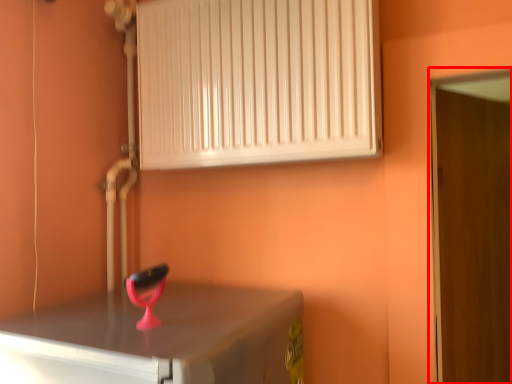
Question: Considering the relative positions of door (annotated by the red box) and radiator in the image provided, where is door (annotated by the red box) located with respect to the staircase?

Choices:
 (A) left
 (B) right

Answer: (B)